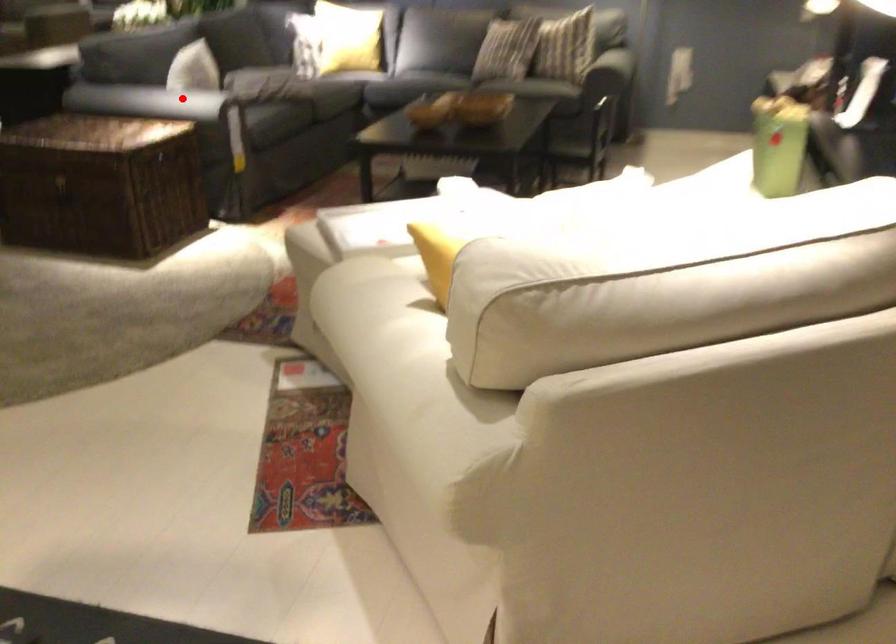
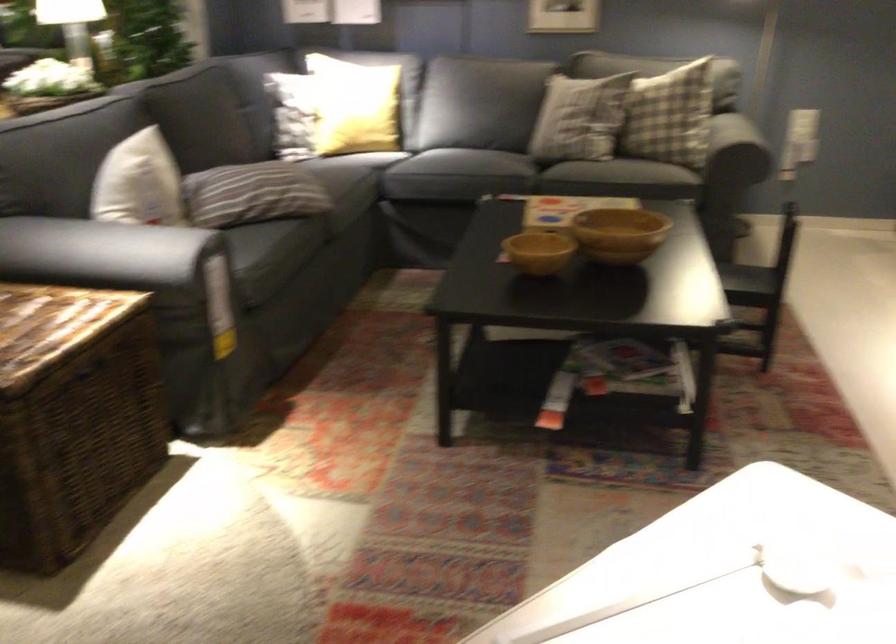
Question: I am providing you with two images of the same scene from different viewpoints. A red point is shown in image1. For the corresponding object point in image2, is it positioned nearer or farther from the camera?

Choices:
 (A) Nearer
 (B) Farther

Answer: (A)